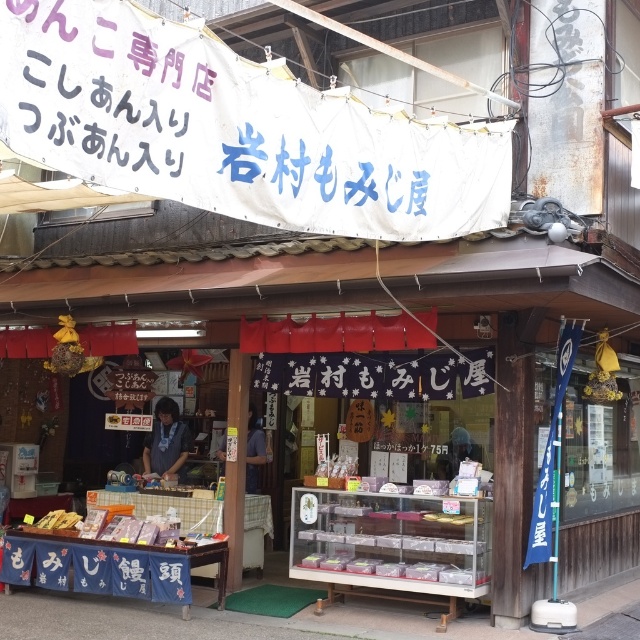
You are standing in front of the shop and want to take a photo. There are two points you want to focus on, point (72, 3) and point (152, 470). Which point should you focus on first to ensure it is in clear view?

Point (72, 3) should be focused on first because it is closer to the camera than point (152, 470).

You are a customer standing in front of the shop and want to take a photo of the purple text on the white banner. You notice two points marked on the banner. Which point is closer to you, point (141, 166) or point (342, 461)?

Point (141, 166) is in front of point (342, 461), so it is closer to you.

You are a customer at the shop and want to choose between the matte white box at center and the matte plastic box at center. Which box is wider?

The matte white box at center is wider than the matte plastic box at center according to the description.